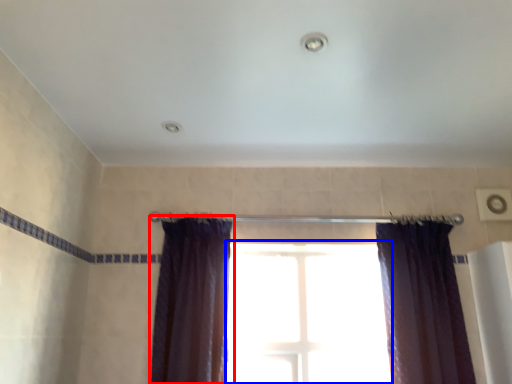
Question: Which object appears farthest to the camera in this image, curtain (highlighted by a red box) or window (highlighted by a blue box)?

Choices:
 (A) curtain
 (B) window

Answer: (B)